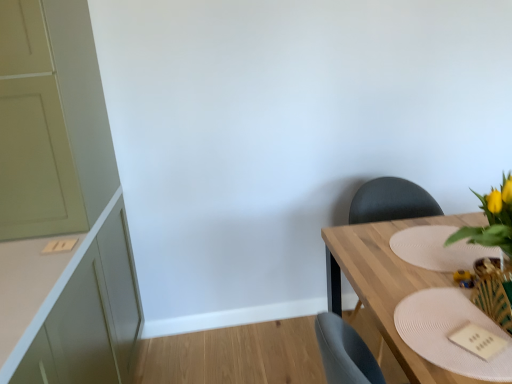
Where is `vacant space underneath white textured placemat at right, placed as the 2th plate when sorted from bottom to top (from a real-world perspective)`? The image size is (512, 384). vacant space underneath white textured placemat at right, placed as the 2th plate when sorted from bottom to top (from a real-world perspective) is located at coordinates (434, 252).